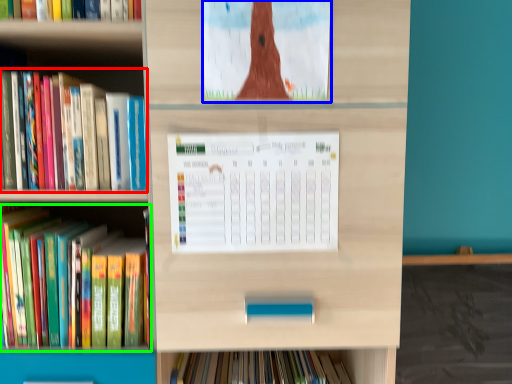
Question: Based on their relative distances, which object is farther from book (highlighted by a red box)? Choose from book cover (highlighted by a blue box) and book (highlighted by a green box).

Choices:
 (A) book cover
 (B) book

Answer: (A)